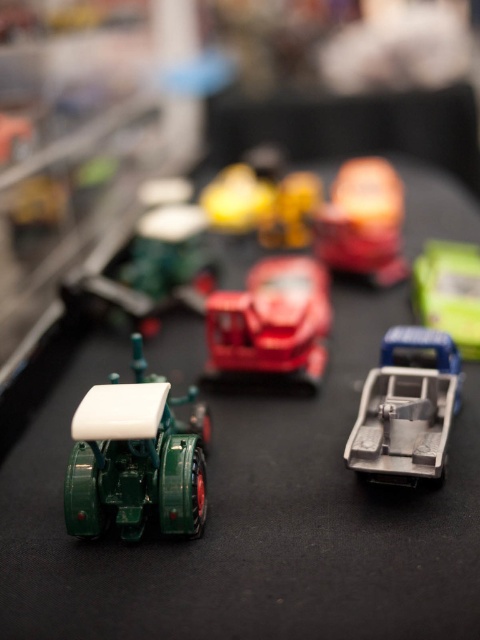
Locate an element on the screen. This screenshot has height=640, width=480. gray metallic truck at right is located at coordinates (407, 408).

Is gray metallic truck at right thinner than shiny yellow toy at center?

Yes.

Does point (450, 400) lie behind point (286, 224)?

No, (450, 400) is in front of (286, 224).

At what (x,y) coordinates should I click in order to perform the action: click on gray metallic truck at right. Please return your answer as a coordinate pair (x, y). This screenshot has height=640, width=480. Looking at the image, I should click on (407, 408).

Which is more to the left, gray metallic truck at right or glossy plastic toy car at center?

Positioned to the left is glossy plastic toy car at center.

Can you confirm if gray metallic truck at right is positioned below glossy plastic toy car at center?

Yes, gray metallic truck at right is below glossy plastic toy car at center.

Which is in front, point (431, 442) or point (262, 336)?

Positioned in front is point (431, 442).

This screenshot has height=640, width=480. What are the coordinates of `gray metallic truck at right` in the screenshot? It's located at (407, 408).

Can you confirm if glossy plastic toy car at center is wider than matte orange toy at center?

Indeed, glossy plastic toy car at center has a greater width compared to matte orange toy at center.

Is point (287, 276) in front of point (396, 243)?

That is True.

At what (x,y) coordinates should I click in order to perform the action: click on glossy plastic toy car at center. Please return your answer as a coordinate pair (x, y). The image size is (480, 640). Looking at the image, I should click on (272, 321).